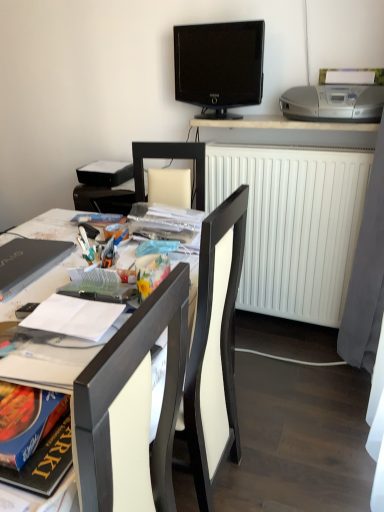
Question: Does black glossy tv at upper center have a lesser height compared to black matte book at upper center?

Choices:
 (A) no
 (B) yes

Answer: (A)

Question: Does black glossy tv at upper center contain black matte book at upper center?

Choices:
 (A) yes
 (B) no

Answer: (B)

Question: Does black glossy tv at upper center have a greater height compared to black matte book at upper center?

Choices:
 (A) yes
 (B) no

Answer: (A)

Question: Is black glossy tv at upper center facing away from black matte book at upper center?

Choices:
 (A) no
 (B) yes

Answer: (A)

Question: Is black glossy tv at upper center directly adjacent to black matte book at upper center?

Choices:
 (A) no
 (B) yes

Answer: (A)

Question: Is black glossy tv at upper center completely or partially outside of black matte book at upper center?

Choices:
 (A) yes
 (B) no

Answer: (A)

Question: Considering the relative sizes of white glossy desk at upper center, which is counted as the second desk, starting from the front, and matte black desk at center, which is the 1th desk in bottom-to-top order, in the image provided, is white glossy desk at upper center, which is counted as the second desk, starting from the front, bigger than matte black desk at center, which is the 1th desk in bottom-to-top order,?

Choices:
 (A) yes
 (B) no

Answer: (B)

Question: Is white glossy desk at upper center, which ranks as the first desk in right-to-left order, oriented towards matte black desk at center, marked as the 2th desk in a back-to-front arrangement?

Choices:
 (A) no
 (B) yes

Answer: (A)

Question: Is white glossy desk at upper center, which is the 1th desk in top-to-bottom order, directly adjacent to matte black desk at center, which appears as the second desk when viewed from the right?

Choices:
 (A) yes
 (B) no

Answer: (B)

Question: Can you confirm if white glossy desk at upper center, the second desk from the left, is taller than matte black desk at center, marked as the first desk in a left-to-right arrangement?

Choices:
 (A) yes
 (B) no

Answer: (B)

Question: Is white glossy desk at upper center, which is counted as the second desk, starting from the front, at the right side of matte black desk at center, marked as the first desk in a left-to-right arrangement?

Choices:
 (A) yes
 (B) no

Answer: (A)

Question: From the image's perspective, is white glossy desk at upper center, acting as the first desk starting from the back, over matte black desk at center, marked as the first desk in a left-to-right arrangement?

Choices:
 (A) yes
 (B) no

Answer: (A)

Question: Can you confirm if silver plastic printer at upper right is thinner than hardcover book at center-left?

Choices:
 (A) yes
 (B) no

Answer: (B)